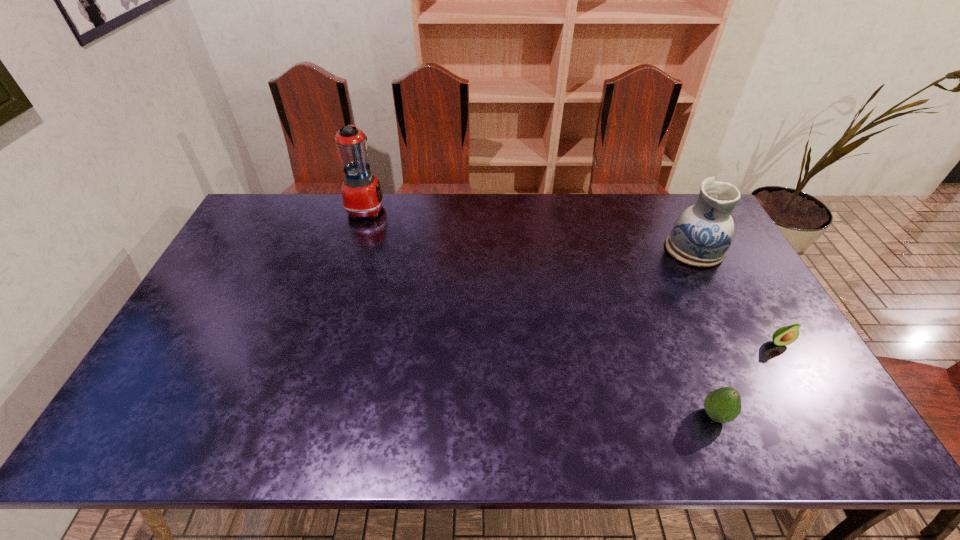
Find the location of a particular element. vacant area that lies between the nearer avocado and the shorter avocado is located at coordinates (747, 379).

You are a GUI agent. You are given a task and a screenshot of the screen. Output one action in this format:
    pyautogui.click(x=<x>, y=<y>)
    Task: Click on the free space that is in between the second farthest object and the right avocado
    This screenshot has height=540, width=960.
    Given the screenshot: What is the action you would take?
    pyautogui.click(x=736, y=296)

This screenshot has width=960, height=540. Find the location of `vacant area that lies between the farther avocado and the left avocado`. vacant area that lies between the farther avocado and the left avocado is located at coordinates (747, 379).

You are a GUI agent. You are given a task and a screenshot of the screen. Output one action in this format:
    pyautogui.click(x=<x>, y=<y>)
    Task: Click on the object that is the third closest one to the taller avocado
    This screenshot has height=540, width=960.
    Given the screenshot: What is the action you would take?
    pyautogui.click(x=362, y=195)

You are a GUI agent. You are given a task and a screenshot of the screen. Output one action in this format:
    pyautogui.click(x=<x>, y=<y>)
    Task: Click on the second closest object relative to the pottery
    The image size is (960, 540).
    Given the screenshot: What is the action you would take?
    pyautogui.click(x=722, y=405)

This screenshot has height=540, width=960. Find the location of `free point that satisfies the following two spatial constraints: 1. on the controls of the food processor; 2. on the right side of the third shortest object`. free point that satisfies the following two spatial constraints: 1. on the controls of the food processor; 2. on the right side of the third shortest object is located at coordinates (353, 249).

Locate an element on the screen. The height and width of the screenshot is (540, 960). blank area in the image that satisfies the following two spatial constraints: 1. on the controls of the nearest object; 2. on the right side of the farthest object is located at coordinates (302, 415).

Identify the location of vacant space that satisfies the following two spatial constraints: 1. on the controls of the pottery; 2. on the right side of the food processor. Image resolution: width=960 pixels, height=540 pixels. (353, 249).

Locate an element on the screen. Image resolution: width=960 pixels, height=540 pixels. vacant position in the image that satisfies the following two spatial constraints: 1. on the back side of the taller avocado; 2. on the controls of the food processor is located at coordinates (632, 208).

Where is `vacant space that satisfies the following two spatial constraints: 1. on the controls of the nearest object; 2. on the right side of the leftmost object`? vacant space that satisfies the following two spatial constraints: 1. on the controls of the nearest object; 2. on the right side of the leftmost object is located at coordinates (302, 415).